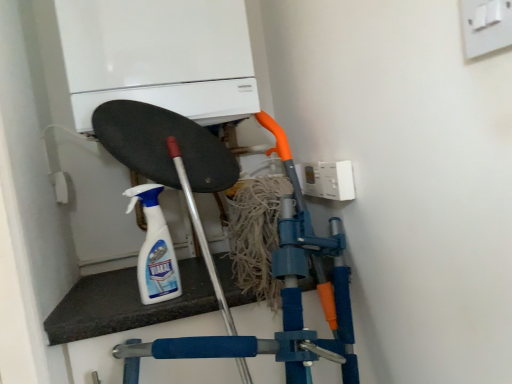
Image resolution: width=512 pixels, height=384 pixels. In order to click on white plastic switch at upper right, the first electric outlet from the top in this screenshot , I will do `click(485, 26)`.

The height and width of the screenshot is (384, 512). What do you see at coordinates (169, 159) in the screenshot?
I see `blue rubber vacuum at center` at bounding box center [169, 159].

Where is `white plastic electric outlet at upper right, arranged as the 1th electric outlet when viewed from the left`? This screenshot has width=512, height=384. white plastic electric outlet at upper right, arranged as the 1th electric outlet when viewed from the left is located at coordinates (329, 180).

Locate an element on the screen. The image size is (512, 384). white plastic spray bottle at center is located at coordinates (155, 249).

You are a GUI agent. You are given a task and a screenshot of the screen. Output one action in this format:
    pyautogui.click(x=<x>, y=<y>)
    Task: Click on the white plastic switch at upper right, the first electric outlet positioned from the front
    
    Given the screenshot: What is the action you would take?
    pyautogui.click(x=485, y=26)

From the image's perspective, is white plastic spray bottle at center beneath white plastic electric outlet at upper right, the 2th electric outlet from the right?

Indeed, from the image's perspective, white plastic spray bottle at center is shown beneath white plastic electric outlet at upper right, the 2th electric outlet from the right.

Looking at this image, which object is closer to the camera, white plastic spray bottle at center or white plastic electric outlet at upper right, which is the second electric outlet in front-to-back order?

white plastic spray bottle at center is more forward.

Is white plastic spray bottle at center positioned with its back to white plastic electric outlet at upper right, arranged as the 1th electric outlet when viewed from the left?

No, white plastic electric outlet at upper right, arranged as the 1th electric outlet when viewed from the left, is not at the back of white plastic spray bottle at center.

From a real-world perspective, is white plastic spray bottle at center above or below white plastic electric outlet at upper right, which is the 2th electric outlet from top to bottom?

white plastic spray bottle at center is situated lower than white plastic electric outlet at upper right, which is the 2th electric outlet from top to bottom, in the real world.

Considering the positions of objects white matte boiler at upper center and white plastic switch at upper right, the second electric outlet positioned from the left, in the image provided, who is more to the left, white matte boiler at upper center or white plastic switch at upper right, the second electric outlet positioned from the left,?

From the viewer's perspective, white matte boiler at upper center appears more on the left side.

In terms of width, does white matte boiler at upper center look wider or thinner when compared to white plastic switch at upper right, the first electric outlet from the top?

Considering their sizes, white matte boiler at upper center looks broader than white plastic switch at upper right, the first electric outlet from the top.

Measure the distance from white matte boiler at upper center to white plastic switch at upper right, marked as the 2th electric outlet in a back-to-front arrangement.

white matte boiler at upper center and white plastic switch at upper right, marked as the 2th electric outlet in a back-to-front arrangement, are 28.06 inches apart.

Between white matte boiler at upper center and white plastic switch at upper right, the first electric outlet in the right-to-left sequence, which one has more height?

white matte boiler at upper center.

What's the angular difference between blue rubber vacuum at center and white matte boiler at upper center's facing directions?

blue rubber vacuum at center and white matte boiler at upper center are facing 0.00116 degrees away from each other.

From a real-world perspective, which is physically below, blue rubber vacuum at center or white matte boiler at upper center?

From a 3D spatial view, blue rubber vacuum at center is below.

Can you confirm if blue rubber vacuum at center is taller than white matte boiler at upper center?

Correct, blue rubber vacuum at center is much taller as white matte boiler at upper center.

Identify the location of home appliance located behind the blue rubber vacuum at center. (159, 57).

Is white matte boiler at upper center beside white plastic electric outlet at upper right, which is the 2th electric outlet from top to bottom?

There is a gap between white matte boiler at upper center and white plastic electric outlet at upper right, which is the 2th electric outlet from top to bottom.

From the image's perspective, is white matte boiler at upper center above or below white plastic electric outlet at upper right, the 2th electric outlet from the right?

From the image's perspective, white matte boiler at upper center appears above white plastic electric outlet at upper right, the 2th electric outlet from the right.

Can you confirm if white matte boiler at upper center is shorter than white plastic electric outlet at upper right, which is the second electric outlet in front-to-back order?

In fact, white matte boiler at upper center may be taller than white plastic electric outlet at upper right, which is the second electric outlet in front-to-back order.

Considering the points (490, 9) and (190, 84), which point is behind, point (490, 9) or point (190, 84)?

The point (190, 84) is farther.

Is white plastic switch at upper right, marked as the 2th electric outlet in a back-to-front arrangement, aimed at white matte boiler at upper center?

No, white plastic switch at upper right, marked as the 2th electric outlet in a back-to-front arrangement, does not turn towards white matte boiler at upper center.

From a real-world perspective, is white plastic switch at upper right, the first electric outlet from the top, located beneath white matte boiler at upper center?

Yes, from a real-world perspective, white plastic switch at upper right, the first electric outlet from the top, is under white matte boiler at upper center.

Image resolution: width=512 pixels, height=384 pixels. I want to click on the 2nd electric outlet to the right of the white matte boiler at upper center, starting your count from the anchor, so click(x=485, y=26).

Is white plastic electric outlet at upper right, which is the second electric outlet in front-to-back order, at the right side of white plastic switch at upper right, the first electric outlet from the top?

Incorrect, white plastic electric outlet at upper right, which is the second electric outlet in front-to-back order, is not on the right side of white plastic switch at upper right, the first electric outlet from the top.

From a real-world perspective, who is located higher, white plastic electric outlet at upper right, the 2th electric outlet from the right, or white plastic switch at upper right, the first electric outlet positioned from the front?

In real-world perspective, white plastic switch at upper right, the first electric outlet positioned from the front, is above.

Is white plastic switch at upper right, marked as the 2th electric outlet in a back-to-front arrangement, located within white plastic electric outlet at upper right, which is the 2th electric outlet from top to bottom?

No.

Between blue rubber vacuum at center and white plastic electric outlet at upper right, which is the second electric outlet in front-to-back order, which one has larger width?

blue rubber vacuum at center is wider.

How distant is blue rubber vacuum at center from white plastic electric outlet at upper right, which is the 2th electric outlet from top to bottom?

A distance of 9.44 inches exists between blue rubber vacuum at center and white plastic electric outlet at upper right, which is the 2th electric outlet from top to bottom.

From a real-world perspective, who is located lower, blue rubber vacuum at center or white plastic electric outlet at upper right, which is the 2th electric outlet from top to bottom?

blue rubber vacuum at center is physically lower.

Is point (290, 243) closer or farther from the camera than point (318, 192)?

Point (290, 243).

Where is `the 1st electric outlet to the right of the white plastic spray bottle at center, counting from the anchor's position`? This screenshot has width=512, height=384. the 1st electric outlet to the right of the white plastic spray bottle at center, counting from the anchor's position is located at coordinates (329, 180).

The width and height of the screenshot is (512, 384). There is a white matte boiler at upper center. Identify the location of the 1st electric outlet below it (from a real-world perspective). (485, 26).

Which object lies nearer to the anchor point white plastic switch at upper right, the first electric outlet positioned from the front, white plastic electric outlet at upper right, the first electric outlet viewed from the back, or blue rubber vacuum at center?

white plastic electric outlet at upper right, the first electric outlet viewed from the back, is positioned closer to the anchor white plastic switch at upper right, the first electric outlet positioned from the front.

From the picture: Estimate the real-world distances between objects in this image. Which object is further from white plastic electric outlet at upper right, the 2th electric outlet from the right, white plastic switch at upper right, the first electric outlet from the top, or white matte boiler at upper center?

white plastic switch at upper right, the first electric outlet from the top, lies further to white plastic electric outlet at upper right, the 2th electric outlet from the right, than the other object.

Estimate the real-world distances between objects in this image. Which object is further from white plastic electric outlet at upper right, arranged as the 1th electric outlet when viewed from the left, white matte boiler at upper center or blue rubber vacuum at center?

white matte boiler at upper center.

From the image, which object appears to be farther from white plastic spray bottle at center, white plastic electric outlet at upper right, the 2th electric outlet from the right, or blue rubber vacuum at center?

white plastic electric outlet at upper right, the 2th electric outlet from the right, lies further to white plastic spray bottle at center than the other object.

Looking at the image, which one is located closer to white matte boiler at upper center, white plastic electric outlet at upper right, arranged as the 1th electric outlet when viewed from the left, or blue rubber vacuum at center?

blue rubber vacuum at center is positioned closer to the anchor white matte boiler at upper center.

Which object lies further to the anchor point white matte boiler at upper center, blue rubber vacuum at center or white plastic switch at upper right, marked as the 2th electric outlet in a back-to-front arrangement?

white plastic switch at upper right, marked as the 2th electric outlet in a back-to-front arrangement.

Estimate the real-world distances between objects in this image. Which object is further from blue rubber vacuum at center, white plastic switch at upper right, the second electric outlet positioned from the left, or white plastic electric outlet at upper right, which is the second electric outlet in front-to-back order?

The object further to blue rubber vacuum at center is white plastic switch at upper right, the second electric outlet positioned from the left.

Which object lies nearer to the anchor point white plastic electric outlet at upper right, the 2th electric outlet from the right, white plastic switch at upper right, marked as the second electric outlet in a bottom-to-top arrangement, or blue rubber vacuum at center?

blue rubber vacuum at center.

Where is `cleaning product between white matte boiler at upper center and white plastic switch at upper right, marked as the second electric outlet in a bottom-to-top arrangement`? This screenshot has height=384, width=512. cleaning product between white matte boiler at upper center and white plastic switch at upper right, marked as the second electric outlet in a bottom-to-top arrangement is located at coordinates (155, 249).

Locate an element on the screen. This screenshot has width=512, height=384. cleaning product between white plastic switch at upper right, the second electric outlet positioned from the left, and white plastic electric outlet at upper right, which appears as the first electric outlet when ordered from the bottom, along the z-axis is located at coordinates (155, 249).

Find the location of a particular element. vacuum located between white plastic switch at upper right, marked as the 2th electric outlet in a back-to-front arrangement, and white plastic electric outlet at upper right, which appears as the first electric outlet when ordered from the bottom, in the depth direction is located at coordinates (169, 159).

Where is `electric outlet between white matte boiler at upper center and white plastic switch at upper right, marked as the second electric outlet in a bottom-to-top arrangement`? This screenshot has height=384, width=512. electric outlet between white matte boiler at upper center and white plastic switch at upper right, marked as the second electric outlet in a bottom-to-top arrangement is located at coordinates (329, 180).